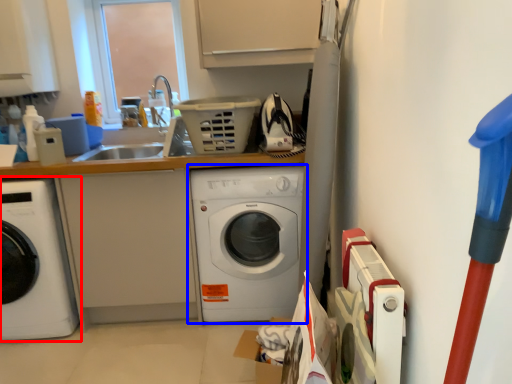
Question: Which of the following is the farthest to the observer, washing machine (highlighted by a red box) or washing machine (highlighted by a blue box)?

Choices:
 (A) washing machine
 (B) washing machine

Answer: (B)